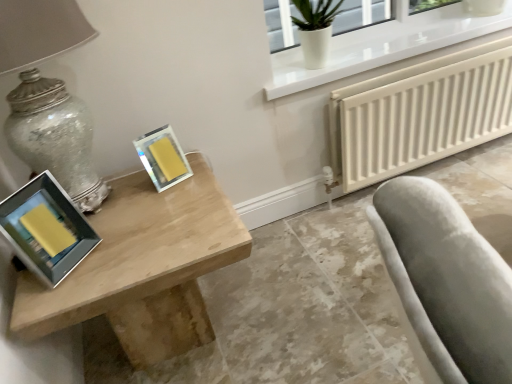
The height and width of the screenshot is (384, 512). What are the coordinates of `vacant area on the back side of matte yellow picture frame at left, the first picture frame from the left` in the screenshot? It's located at (106, 211).